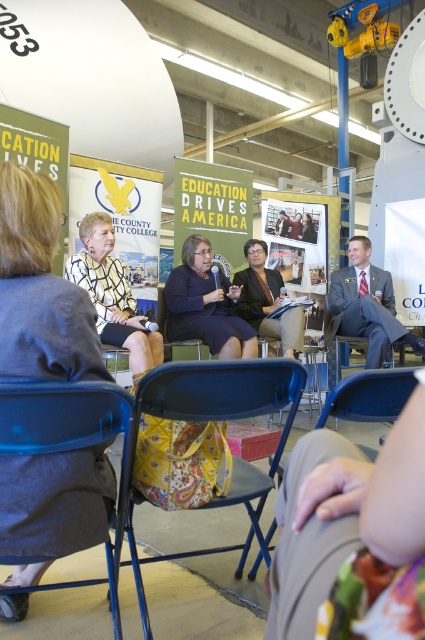
You are a photographer at the event and need to capture a closeup shot of the patterned fabric dress at center without including the blue fabric chair at lower left in the frame. Is the dress narrow enough to fit within the camera frame without the chair?

The patterned fabric dress at center has a lesser width compared to blue fabric chair at lower left, so yes, the dress can be framed without including the chair as it is narrower than the chair.

You are a photographer standing at the back of the room. You want to take a photo that includes both the blue fabric chair at lower left and the matte black dress at center. The camera you are using has a maximum focus range of 2.5 meters. Will you be able to capture both subjects in focus without moving closer?

The distance between the blue fabric chair at lower left and the matte black dress at center is 2.69 meters. Since the camera can only focus within 2.5 meters, the subjects are slightly out of the focus range. Moving closer to reduce the distance would be necessary for both to be in focus.

Based on the scene description, can you determine the spatial relationship between the patterned fabric dress at center and the blue fabric chair at lower left?

The patterned fabric dress at center is to the left of the blue fabric chair at lower left.